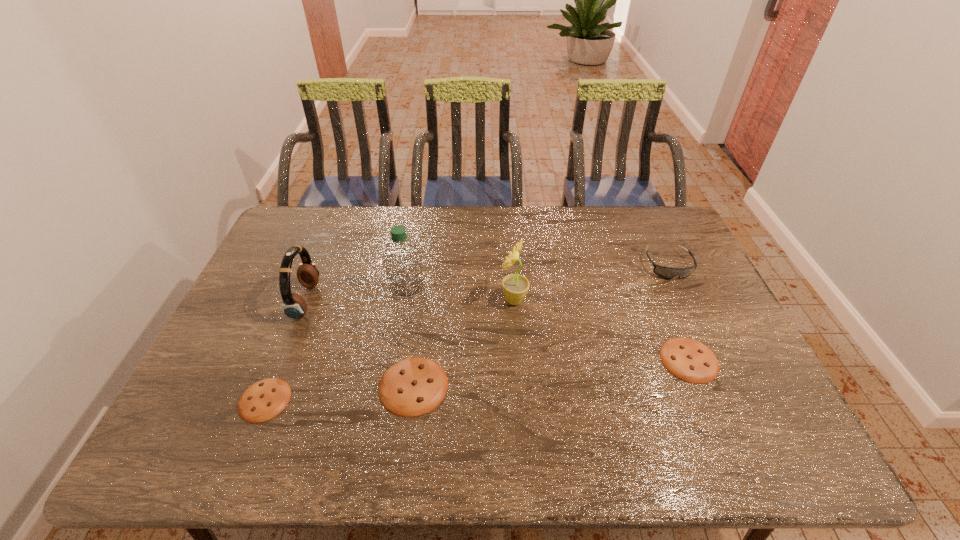
Find the location of `cookie at the right edge`. cookie at the right edge is located at coordinates (687, 359).

Image resolution: width=960 pixels, height=540 pixels. I want to click on goggles that is at the right edge, so click(665, 272).

The image size is (960, 540). Identify the location of object at the near left corner. (265, 399).

In the image, there is a desktop. What are the coordinates of `vacant space at the far edge` in the screenshot? It's located at (431, 213).

In the image, there is a desktop. Where is `vacant space at the left edge`? vacant space at the left edge is located at coordinates (296, 270).

You are a GUI agent. You are given a task and a screenshot of the screen. Output one action in this format:
    pyautogui.click(x=<x>, y=<y>)
    Task: Click on the vacant space at the right edge of the desktop
    
    Given the screenshot: What is the action you would take?
    pyautogui.click(x=734, y=369)

In the image, there is a desktop. Identify the location of free space at the far left corner. The image size is (960, 540). (313, 238).

In the image, there is a desktop. In order to click on vacant area at the far right corner in this screenshot , I will do `click(637, 222)`.

You are a GUI agent. You are given a task and a screenshot of the screen. Output one action in this format:
    pyautogui.click(x=<x>, y=<y>)
    Task: Click on the free spot between the water bottle and the second cookie from right to left
    Image resolution: width=960 pixels, height=540 pixels.
    Given the screenshot: What is the action you would take?
    pyautogui.click(x=410, y=336)

Where is `vacant space that's between the goggles and the second cookie from right to left`? The width and height of the screenshot is (960, 540). vacant space that's between the goggles and the second cookie from right to left is located at coordinates (540, 326).